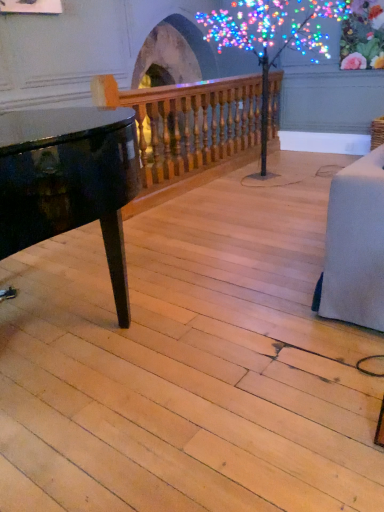
Question: Is wooden baluster at upper center aimed at illuminated plastic tree at center?

Choices:
 (A) no
 (B) yes

Answer: (B)

Question: Can you confirm if wooden baluster at upper center is shorter than illuminated plastic tree at center?

Choices:
 (A) no
 (B) yes

Answer: (B)

Question: Does wooden baluster at upper center touch illuminated plastic tree at center?

Choices:
 (A) no
 (B) yes

Answer: (A)

Question: Is wooden baluster at upper center bigger than illuminated plastic tree at center?

Choices:
 (A) yes
 (B) no

Answer: (B)

Question: From a real-world perspective, is wooden baluster at upper center beneath illuminated plastic tree at center?

Choices:
 (A) yes
 (B) no

Answer: (A)

Question: From the image's perspective, is wooden baluster at upper center over illuminated plastic tree at center?

Choices:
 (A) no
 (B) yes

Answer: (A)

Question: Can you confirm if illuminated plastic tree at center is shorter than wooden baluster at upper center?

Choices:
 (A) no
 (B) yes

Answer: (A)

Question: Is illuminated plastic tree at center smaller than wooden baluster at upper center?

Choices:
 (A) no
 (B) yes

Answer: (A)

Question: From the image's perspective, does illuminated plastic tree at center appear lower than wooden baluster at upper center?

Choices:
 (A) yes
 (B) no

Answer: (B)

Question: Is illuminated plastic tree at center looking in the opposite direction of wooden baluster at upper center?

Choices:
 (A) yes
 (B) no

Answer: (A)

Question: Can you confirm if illuminated plastic tree at center is taller than wooden baluster at upper center?

Choices:
 (A) yes
 (B) no

Answer: (A)

Question: From the image's perspective, is illuminated plastic tree at center above wooden baluster at upper center?

Choices:
 (A) no
 (B) yes

Answer: (B)

Question: Considering the positions of wooden baluster at upper center and illuminated plastic tree at center in the image, is wooden baluster at upper center taller or shorter than illuminated plastic tree at center?

Choices:
 (A) short
 (B) tall

Answer: (A)